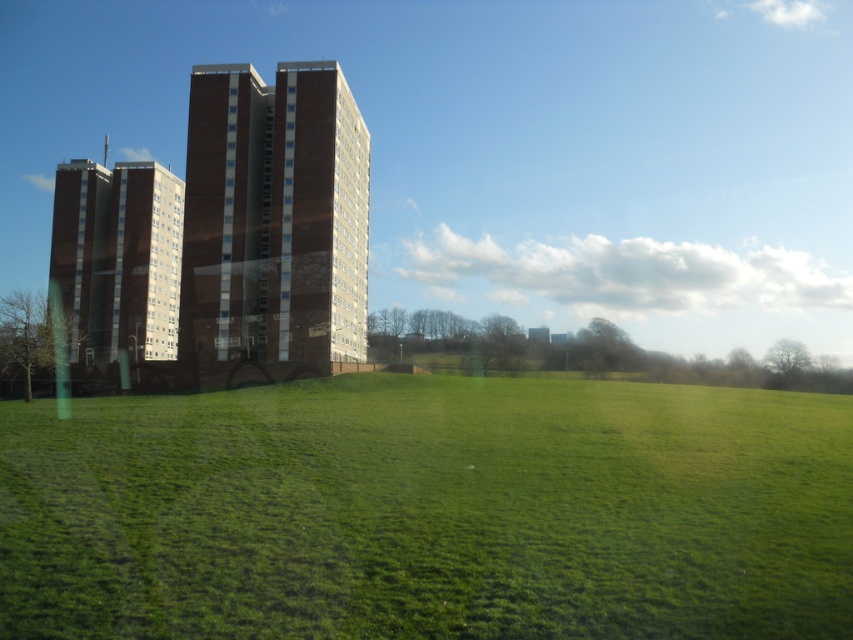
Between green grass at center and brown brick building at left, which one appears on the left side from the viewer's perspective?

brown brick building at left is more to the left.

Does green grass at center appear on the right side of brown brick building at left?

Indeed, green grass at center is positioned on the right side of brown brick building at left.

Is point (659, 442) positioned behind point (51, 248)?

No, it is in front of (51, 248).

Image resolution: width=853 pixels, height=640 pixels. I want to click on green grass at center, so [x=428, y=512].

Which is in front, point (206, 317) or point (132, 177)?

Positioned in front is point (206, 317).

Can you confirm if brown brick building at center is positioned below brown brick building at left?

Actually, brown brick building at center is above brown brick building at left.

The width and height of the screenshot is (853, 640). What do you see at coordinates (274, 216) in the screenshot?
I see `brown brick building at center` at bounding box center [274, 216].

The width and height of the screenshot is (853, 640). I want to click on brown brick building at center, so click(x=274, y=216).

Describe the element at coordinates (428, 512) in the screenshot. I see `green grass at center` at that location.

Does point (374, 557) lie in front of point (305, 136)?

Yes, it is in front of point (305, 136).

You are a GUI agent. You are given a task and a screenshot of the screen. Output one action in this format:
    pyautogui.click(x=<x>, y=<y>)
    Task: Click on the green grass at center
    The image size is (853, 640).
    Given the screenshot: What is the action you would take?
    coord(428,512)

Locate an element on the screen. green grass at center is located at coordinates (428, 512).